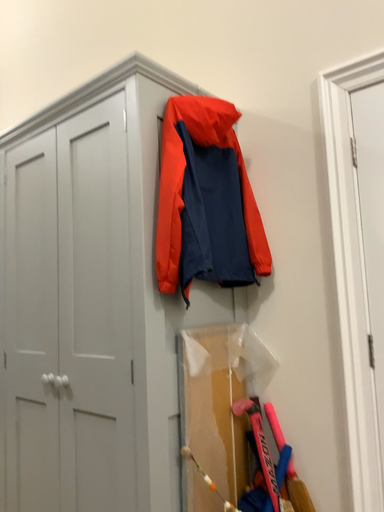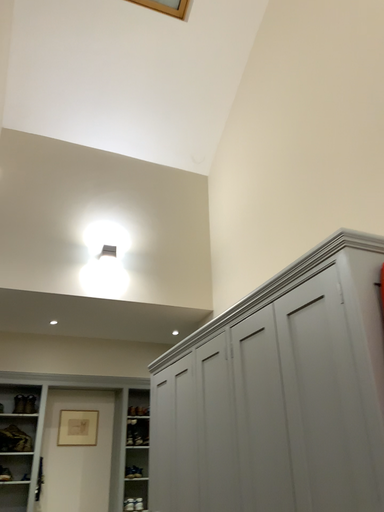
Question: How did the camera likely rotate when shooting the video?

Choices:
 (A) rotated right
 (B) rotated left

Answer: (B)